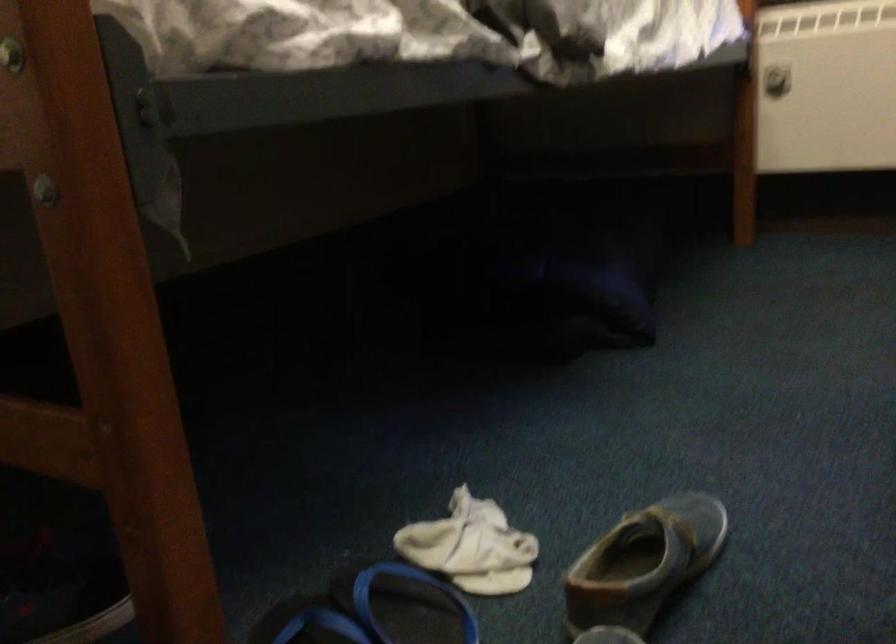
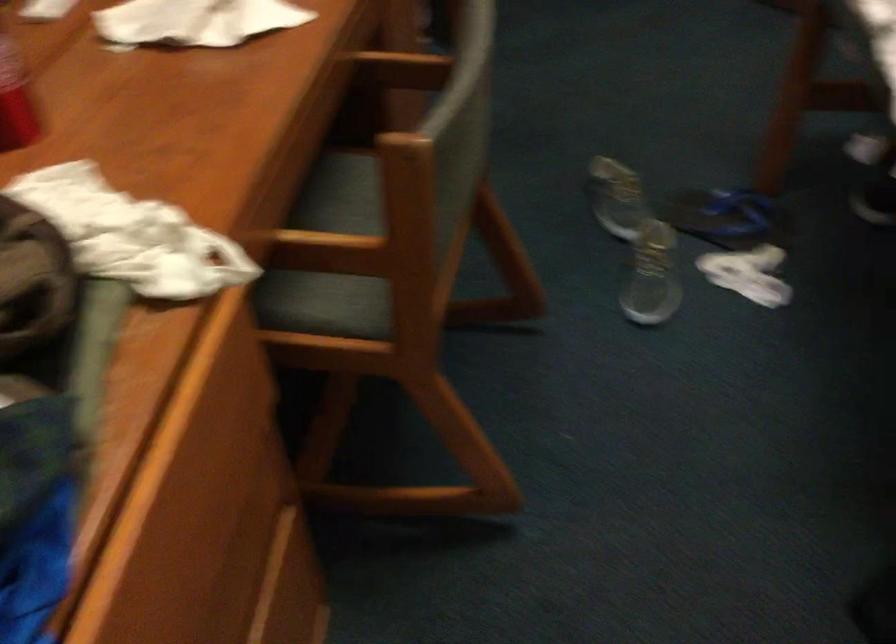
The point at [668,512] is marked in the first image. Where is the corresponding point in the second image?

(650, 287)